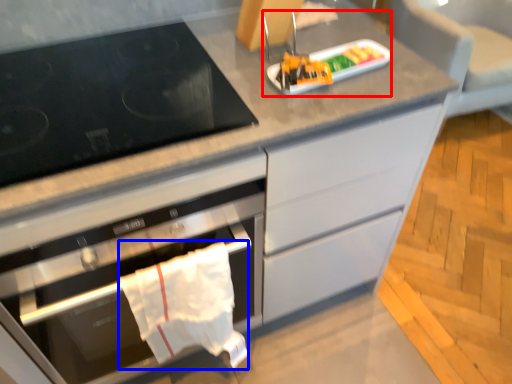
Question: Which object appears closest to the camera in this image, appliance (highlighted by a red box) or material (highlighted by a blue box)?

Choices:
 (A) appliance
 (B) material

Answer: (B)